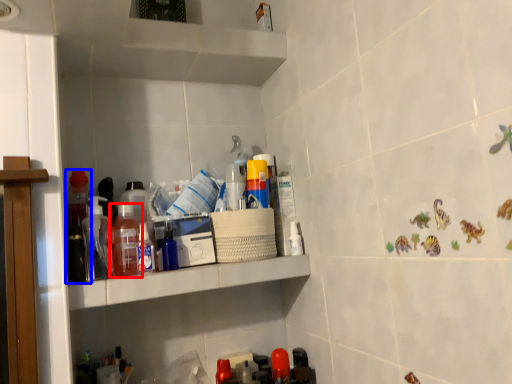
Question: Which object appears closest to the camera in this image, bottle (highlighted by a red box) or bottle (highlighted by a blue box)?

Choices:
 (A) bottle
 (B) bottle

Answer: (A)